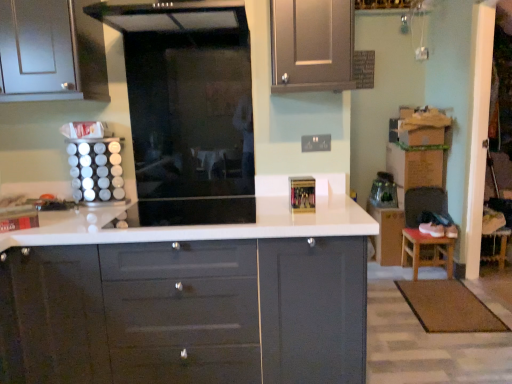
At what (x,y) coordinates should I click in order to perform the action: click on empty space that is ontop of white glossy spice rack at left (from a real-world perspective). Please return your answer as a coordinate pair (x, y). The image size is (512, 384). Looking at the image, I should click on (106, 135).